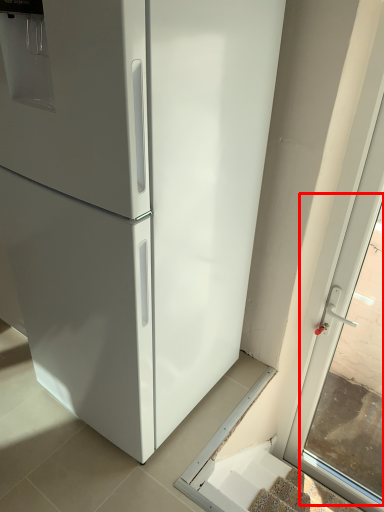
Question: From the image's perspective, considering the relative positions of window (annotated by the red box) and stairs in the image provided, where is window (annotated by the red box) located with respect to the staircase?

Choices:
 (A) above
 (B) below

Answer: (A)